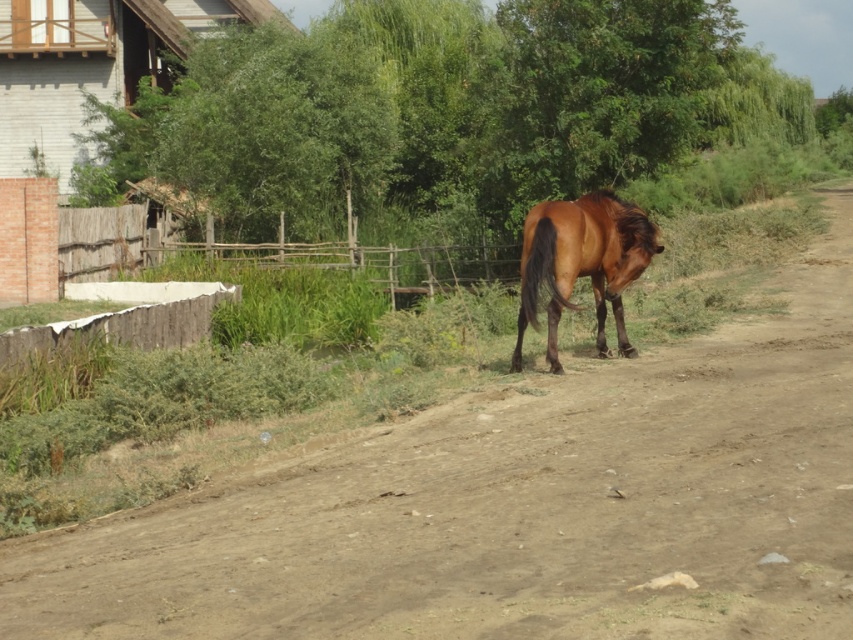
You are a delivery person trying to drive a truck along the brown dirt track at center. The truck is 2 meters tall. Can the truck pass under the brown glossy horse at center?

The brown dirt track at center is positioned under the brown glossy horse at center, so the truck cannot pass under the horse as it is blocking the path.

You are a hiker approaching the brown glossy horse at center from the direction of the wooden fence. There is a brown dirt track at center in front of the horse. Do you need to detour around the horse to access the dirt track?

The brown dirt track at center is in front of the brown glossy horse at center, so the horse is blocking the path to the dirt track. You will need to detour around the horse to access the dirt track.

You are a photographer standing at a safe distance from the brown dirt track at center. You want to capture a closeup shot of the horse without disturbing it. If your camera has a minimum focusing distance of 4 meters, will you be able to take the photo?

The brown dirt track at center is 4.43 meters away from the camera. Since the minimum focusing distance of the camera is 4 meters, the photographer can take the closeup shot as the distance is within the camera range.